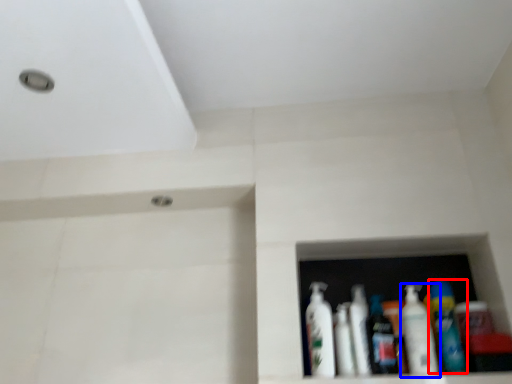
Question: Among these objects, which one is farthest to the camera, bottle (highlighted by a red box) or bottle (highlighted by a blue box)?

Choices:
 (A) bottle
 (B) bottle

Answer: (B)